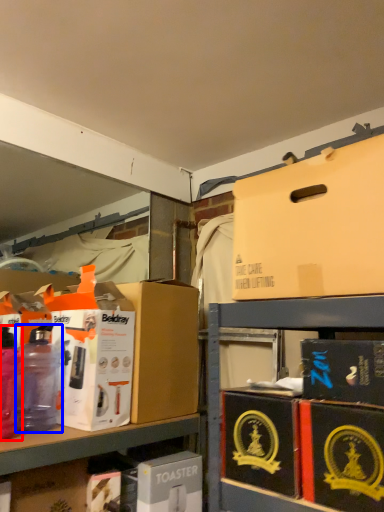
Question: Which object appears farthest to the camera in this image, bottle (highlighted by a red box) or bottle (highlighted by a blue box)?

Choices:
 (A) bottle
 (B) bottle

Answer: (B)